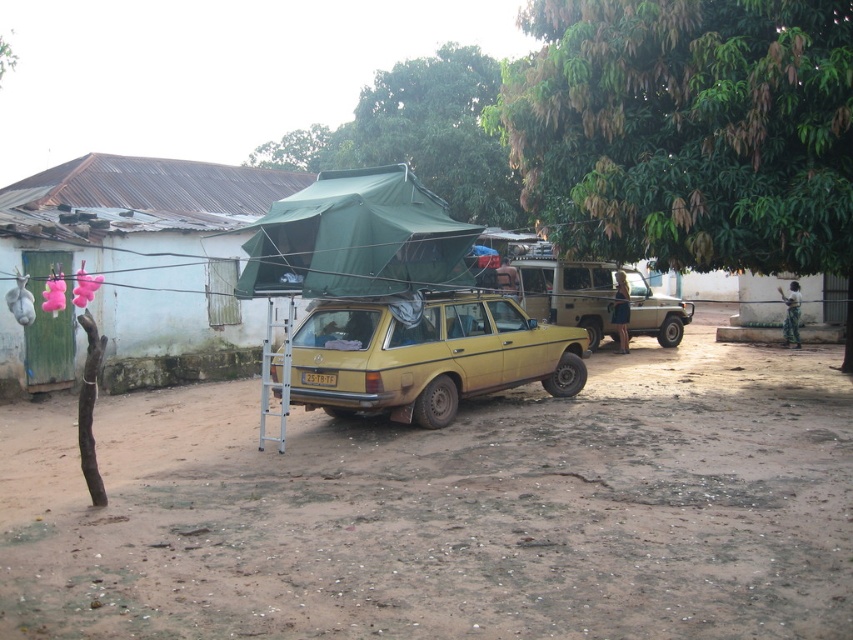
Does point (129, 250) come behind point (387, 84)?

No, (129, 250) is closer to viewer.

Between white painted wood hut at left and green fabric tent at upper center, which one has less height?

white painted wood hut at left

Identify the location of white painted wood hut at left. The height and width of the screenshot is (640, 853). (136, 268).

Is green leafy tree at upper right shorter than green fabric tent at upper center?

Correct, green leafy tree at upper right is not as tall as green fabric tent at upper center.

Identify the location of green leafy tree at upper right. (686, 131).

I want to click on green leafy tree at upper right, so 686,131.

Is dull brown dirt at center positioned in front of green leafy tree at upper right?

Yes, it is.

Does dull brown dirt at center have a larger size compared to green leafy tree at upper right?

Indeed, dull brown dirt at center has a larger size compared to green leafy tree at upper right.

Is point (567, 518) in front of point (675, 144)?

That is True.

I want to click on dull brown dirt at center, so click(448, 512).